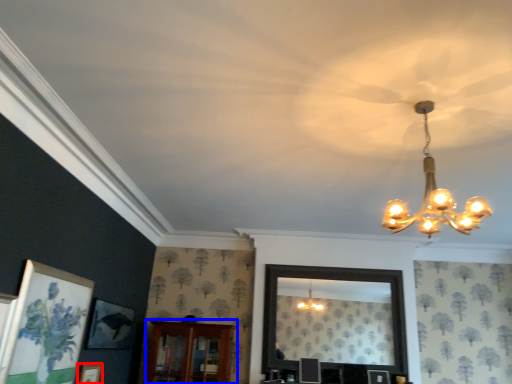
Question: Which of the following is the farthest to the observer, picture frame (highlighted by a red box) or furniture (highlighted by a blue box)?

Choices:
 (A) picture frame
 (B) furniture

Answer: (B)